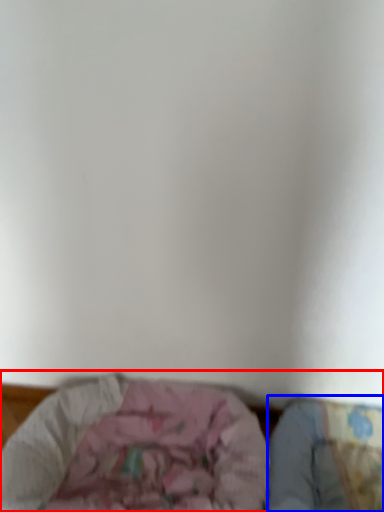
Question: Which object is further to the camera taking this photo, furniture (highlighted by a red box) or sheet (highlighted by a blue box)?

Choices:
 (A) furniture
 (B) sheet

Answer: (B)